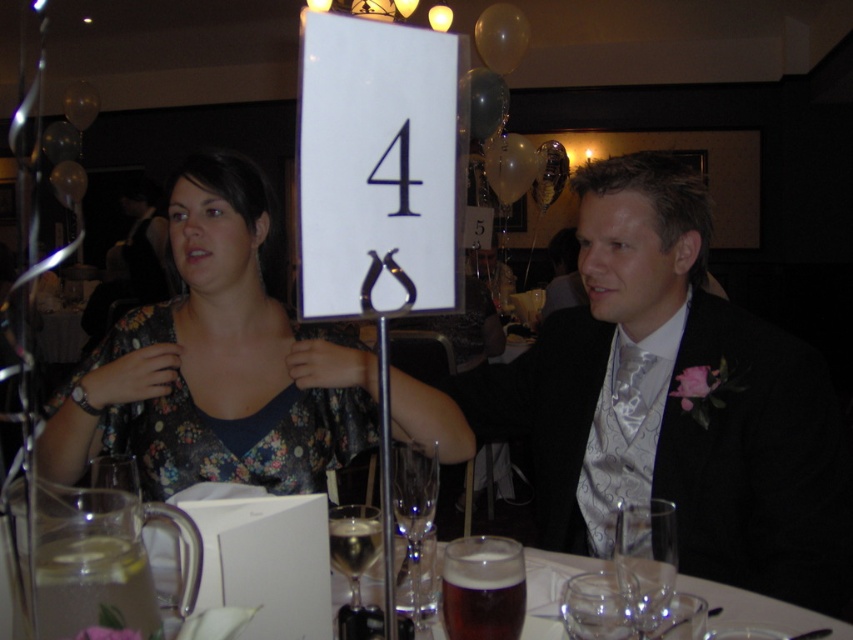
You are a photographer at a formal event. You need to capture a shot of the silvery satin suit at right and the transparent glass at lower center. Based on their positions, which object should appear higher in the photo?

The silvery satin suit at right is above the transparent glass at lower center, so it will appear higher in the photo.

You are a photographer at a wedding reception and need to capture a shot of the silvery satin suit at right and the clear glass wine glass at lower center. Based on their positions, which object is closer to the camera?

The silry satin suit at right is located above the clear glass wine glass at lower center, so it is closer to the camera.